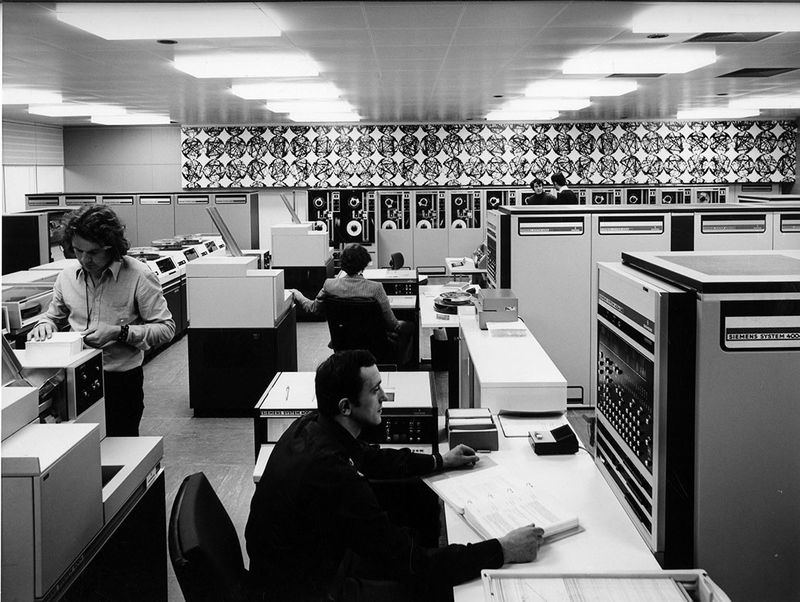
What are the coordinates of `white wall` in the screenshot? It's located at (137, 170).